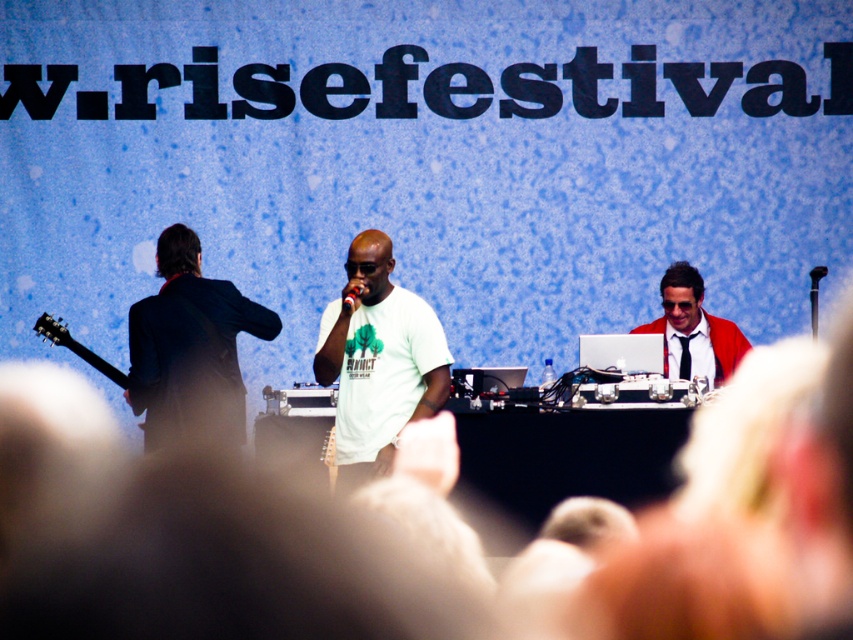
Question: Which point appears closest to the camera in this image?

Choices:
 (A) (213, 353)
 (B) (48, 337)

Answer: (A)

Question: Is white matte t-shirt at center to the right of dark blue suit at left from the viewer's perspective?

Choices:
 (A) yes
 (B) no

Answer: (A)

Question: Which object is positioned farthest from the shiny red jacket at center?

Choices:
 (A) white matte t-shirt at center
 (B) black plastic microphone at center
 (C) dark blue suit at left

Answer: (B)

Question: Is white matte t-shirt at center to the right of black matte guitar at left from the viewer's perspective?

Choices:
 (A) yes
 (B) no

Answer: (A)

Question: Can you confirm if white matte t-shirt at center is wider than shiny red jacket at center?

Choices:
 (A) yes
 (B) no

Answer: (A)

Question: Based on their relative distances, which object is farther from the white matte t-shirt at center?

Choices:
 (A) black matte guitar at left
 (B) shiny red jacket at center
 (C) dark blue suit at left

Answer: (B)